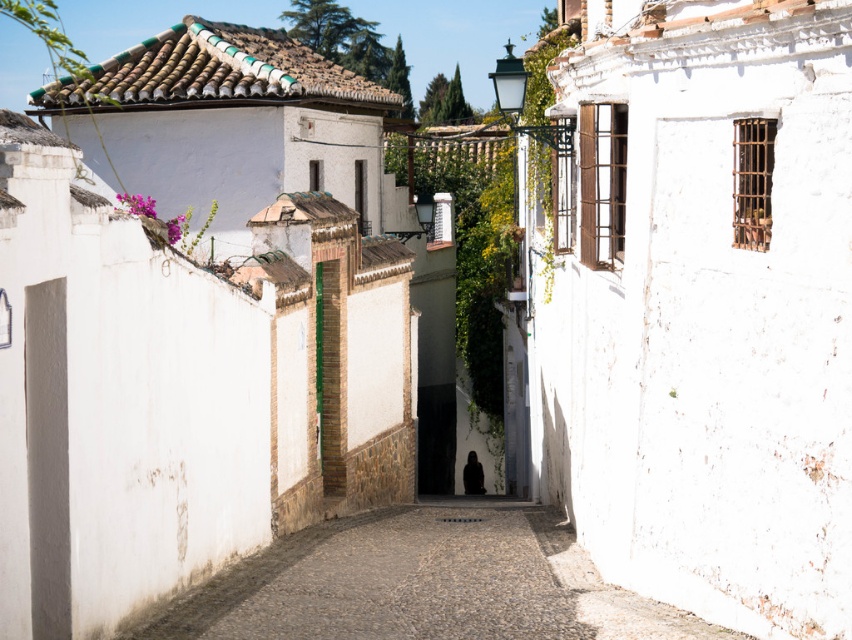
Question: Which object is closer to the camera taking this photo?

Choices:
 (A) white stone alley at center
 (B) white textured wall at right

Answer: (B)

Question: Which of the following is the farthest from the observer?

Choices:
 (A) white stone alley at center
 (B) white textured wall at right

Answer: (A)

Question: Can you confirm if white textured wall at right is wider than white stone alley at center?

Choices:
 (A) no
 (B) yes

Answer: (A)

Question: Where is white textured wall at right located in relation to white stone alley at center in the image?

Choices:
 (A) left
 (B) right

Answer: (B)

Question: Is white textured wall at right above white stone alley at center?

Choices:
 (A) no
 (B) yes

Answer: (B)

Question: Which of the following is the farthest from the observer?

Choices:
 (A) pos(723,632)
 (B) pos(654,518)

Answer: (B)